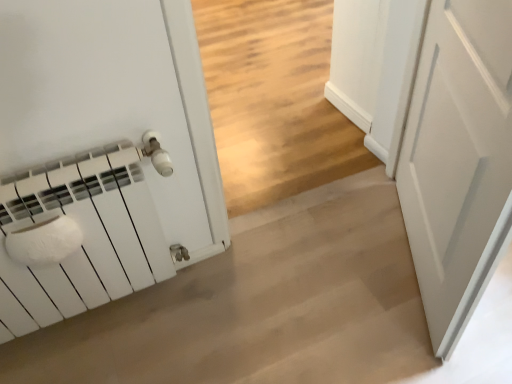
Find the location of a particular element. vacant space in white matte door at right (from a real-world perspective) is located at coordinates (407, 265).